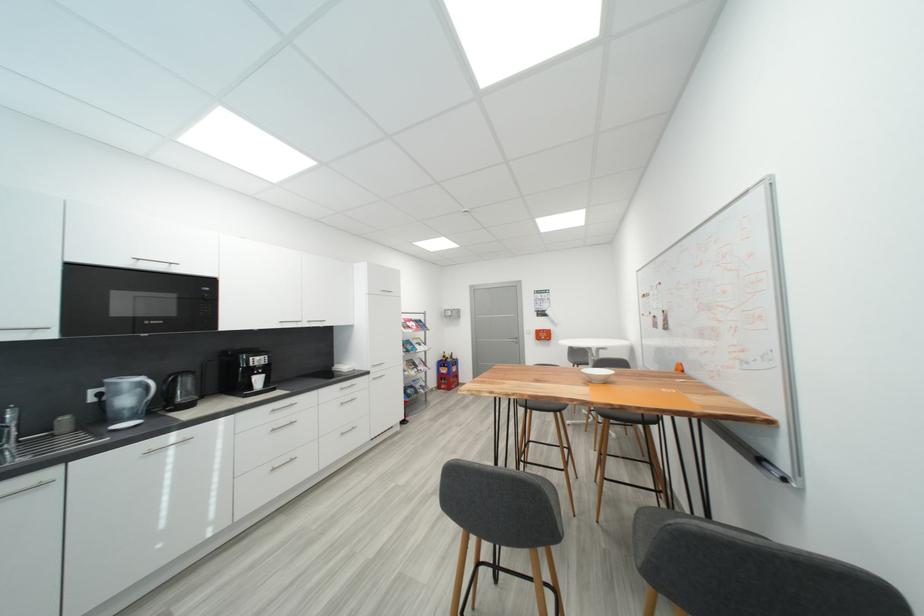
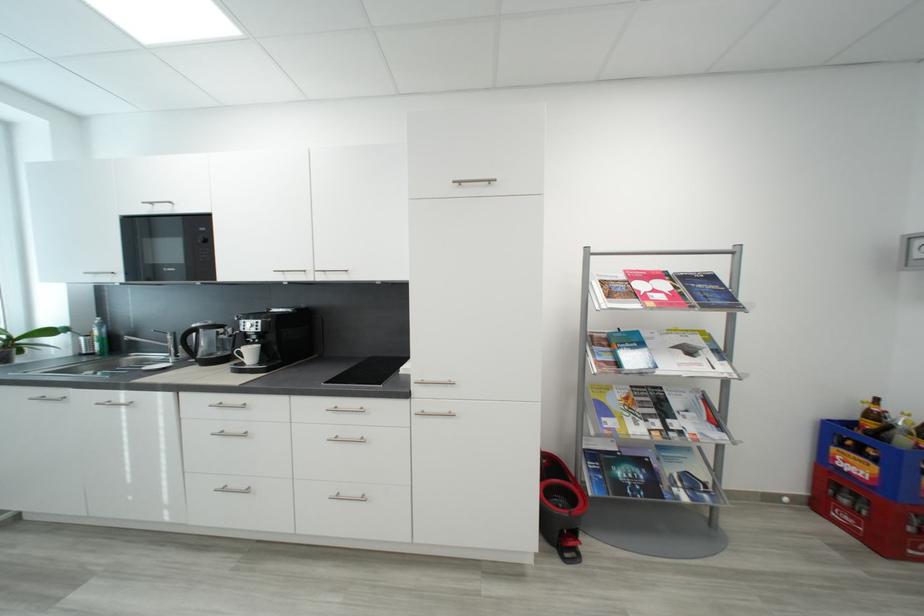
The point at (452, 359) is marked in the first image. Where is the corresponding point in the second image?

(881, 418)